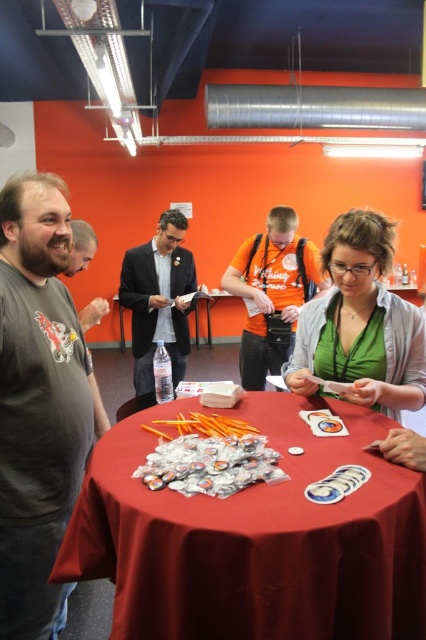
Can you confirm if dark gray t-shirt at left is positioned below orange cotton t-shirt at center?

Yes.

Does dark gray t-shirt at left lie behind orange cotton t-shirt at center?

No, it is in front of orange cotton t-shirt at center.

Image resolution: width=426 pixels, height=640 pixels. I want to click on dark gray t-shirt at left, so click(37, 401).

Between point (287, 316) and point (161, 221), which one is positioned behind?

Positioned behind is point (161, 221).

This screenshot has height=640, width=426. What do you see at coordinates (273, 292) in the screenshot? I see `orange cotton t-shirt at center` at bounding box center [273, 292].

The width and height of the screenshot is (426, 640). Identify the location of orange cotton t-shirt at center. (273, 292).

Which is more to the left, dark gray t-shirt at left or green matte shirt at center?

Positioned to the left is dark gray t-shirt at left.

Does dark gray t-shirt at left lie in front of green matte shirt at center?

Yes, it is in front of green matte shirt at center.

What do you see at coordinates (37, 401) in the screenshot?
I see `dark gray t-shirt at left` at bounding box center [37, 401].

In order to click on dark gray t-shirt at left in this screenshot , I will do `click(37, 401)`.